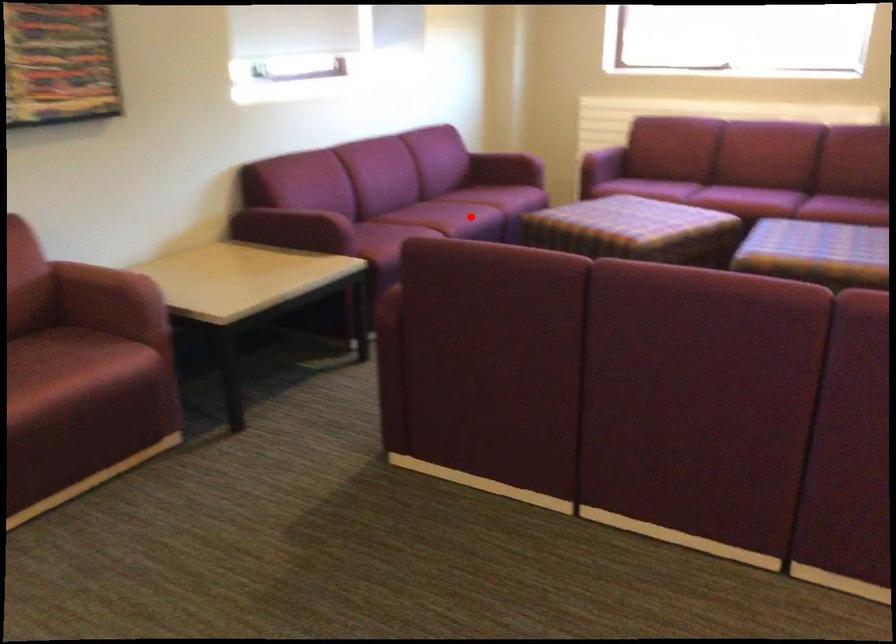
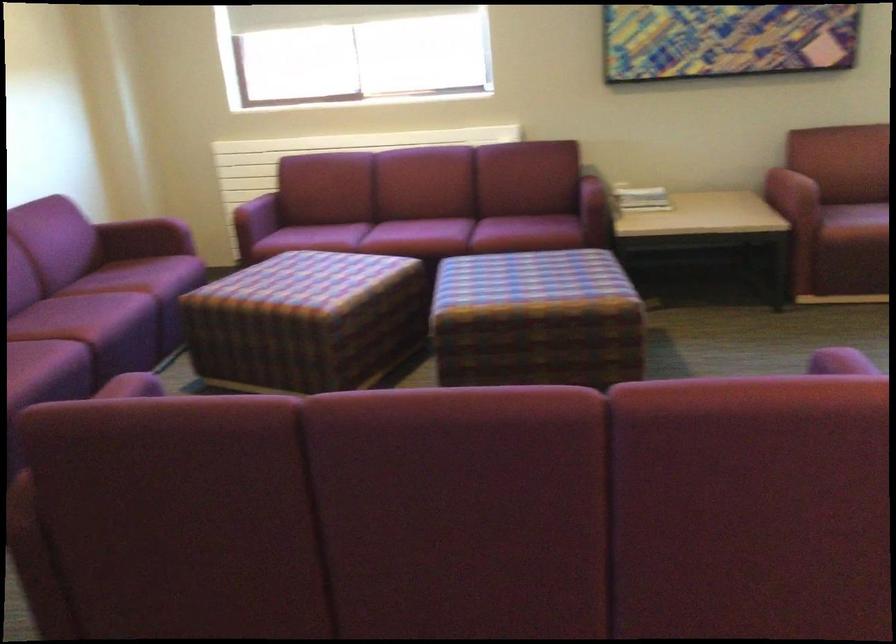
Question: I am providing you with two images of the same scene from different viewpoints. Given a red point in image1, look at the same physical point in image2. Is it:

Choices:
 (A) Closer to the viewpoint
 (B) Farther from the viewpoint

Answer: (A)